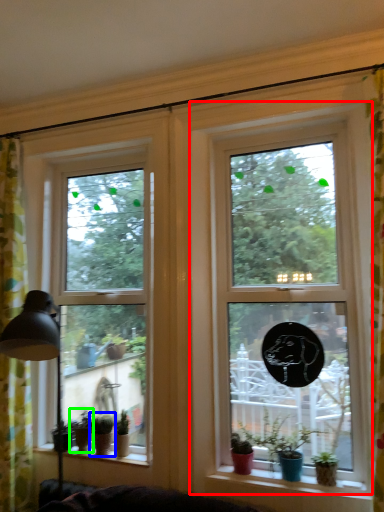
Question: Based on their relative distances, which object is nearer to window (highlighted by a red box)? Choose from houseplant (highlighted by a blue box) and houseplant (highlighted by a green box).

Choices:
 (A) houseplant
 (B) houseplant

Answer: (A)